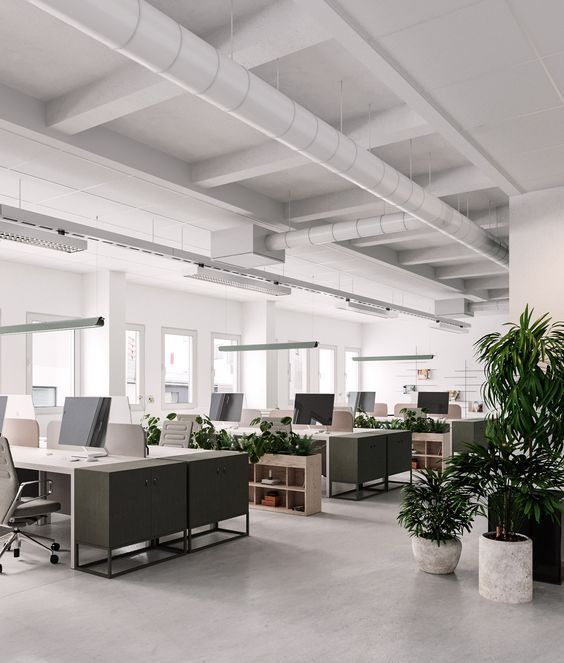
Image resolution: width=564 pixels, height=663 pixels. Find the location of `windows`. windows is located at coordinates (61, 347), (132, 359), (189, 359), (215, 364), (298, 372), (331, 374), (352, 374).